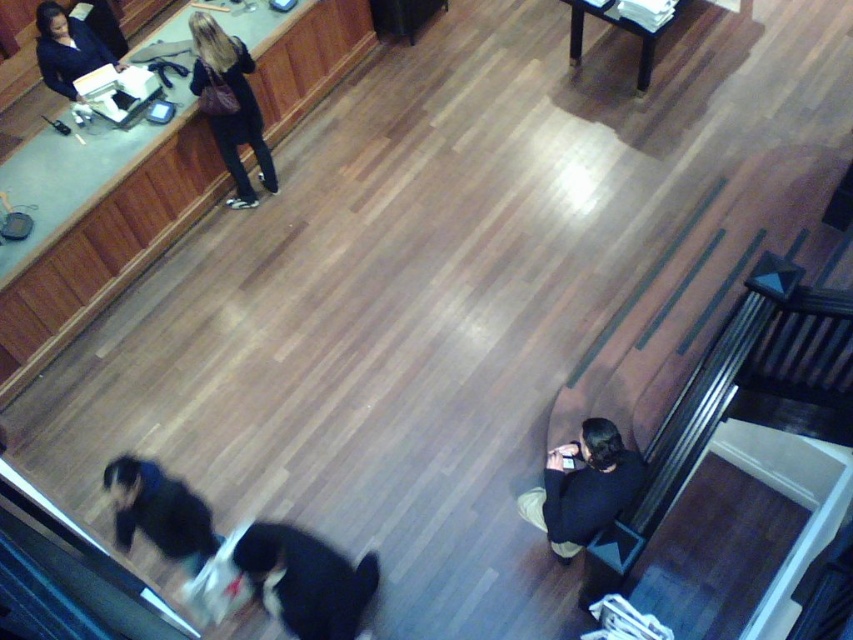
You are standing at the camera position and want to walk to point [247,128]. Is the distance more than 5 meters?

The distance between the camera and point [247,128] is 5.55 meters, so yes, the distance is more than 5 meters.